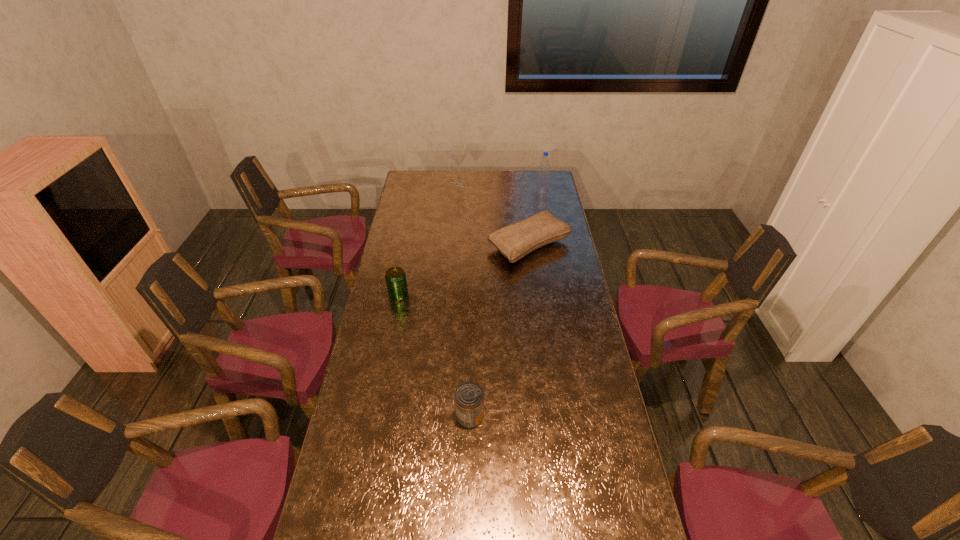
Find the location of a particular element. water bottle is located at coordinates (542, 185).

Locate an element on the screen. This screenshot has height=540, width=960. flute glass is located at coordinates (458, 153).

At what (x,y) coordinates should I click in order to perform the action: click on the third farthest object. Please return your answer as a coordinate pair (x, y). Looking at the image, I should click on (515, 241).

Find the location of `the fourth farthest object`. the fourth farthest object is located at coordinates (395, 277).

The width and height of the screenshot is (960, 540). Identify the location of beer can. coord(395,277).

Image resolution: width=960 pixels, height=540 pixels. Identify the location of the nearest object. (469, 397).

The width and height of the screenshot is (960, 540). In order to click on vacant space located on the back of the water bottle in this screenshot , I will do `click(539, 176)`.

At what (x,y) coordinates should I click in order to perform the action: click on vacant area located on the back of the flute glass. Please return your answer as a coordinate pair (x, y). This screenshot has height=540, width=960. Looking at the image, I should click on (460, 170).

Locate an element on the screen. Image resolution: width=960 pixels, height=540 pixels. vacant area situated on the left of the cushion is located at coordinates (459, 246).

Locate an element on the screen. vacant space located 0.190m on the front of the leftmost object is located at coordinates (390, 339).